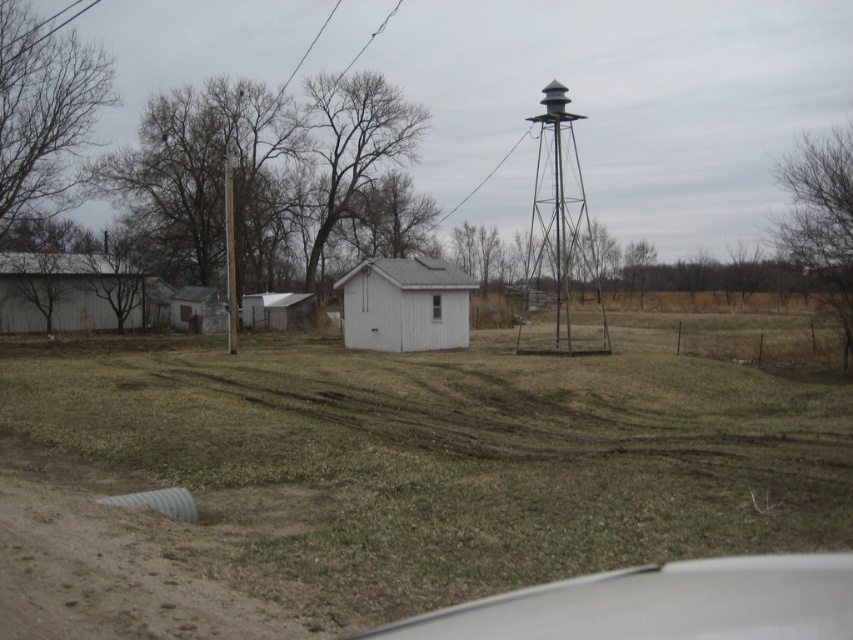
Question: Does green grass at center have a lesser width compared to brown wood cabin at center?

Choices:
 (A) yes
 (B) no

Answer: (B)

Question: Estimate the real-world distances between objects in this image. Which object is closer to the transparent glass window at center?

Choices:
 (A) white matte barn at left
 (B) white wood shed at center

Answer: (B)

Question: Is metallic gray water tower at right to the left of transparent glass window at center from the viewer's perspective?

Choices:
 (A) no
 (B) yes

Answer: (A)

Question: Observing the image, what is the correct spatial positioning of white glossy car window at lower center in reference to brown wood cabin at center?

Choices:
 (A) below
 (B) above

Answer: (A)

Question: Which of these objects is positioned closest to the white corrugated metal hut at center?

Choices:
 (A) transparent glass window at center
 (B) metallic gray water tower at right
 (C) brown wood cabin at center

Answer: (C)

Question: Which object appears farthest from the camera in this image?

Choices:
 (A) white matte barn at left
 (B) transparent glass window at center

Answer: (A)